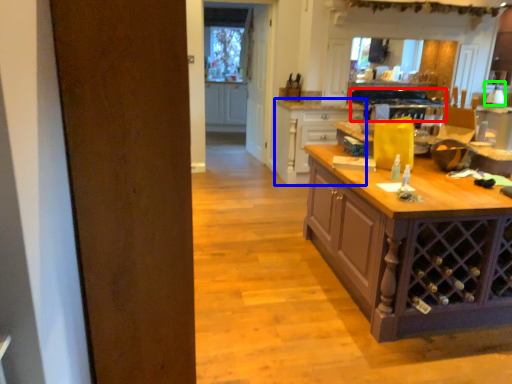
Question: Considering the real-world distances, which object is closest to oven (highlighted by a red box)? cabinetry (highlighted by a blue box) or kitchen appliance (highlighted by a green box).

Choices:
 (A) cabinetry
 (B) kitchen appliance

Answer: (A)